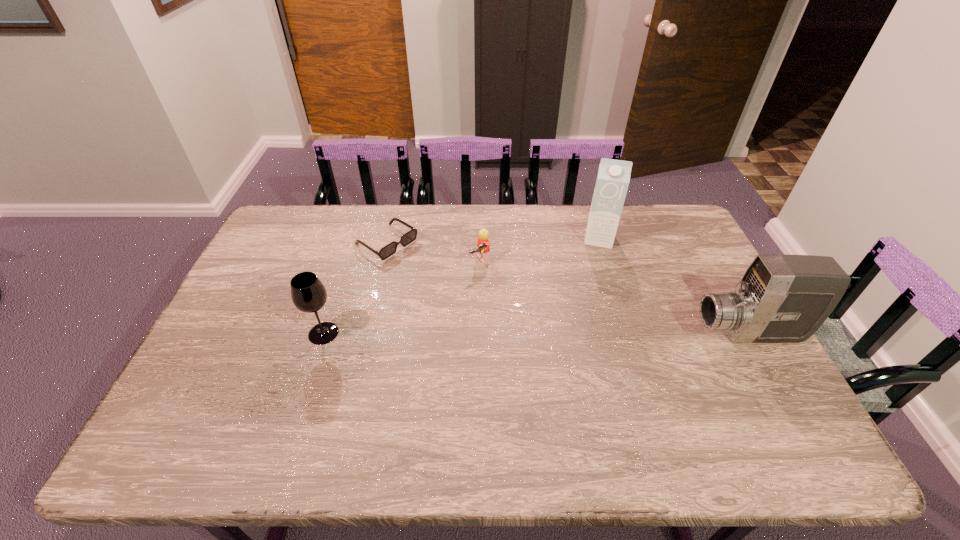
The width and height of the screenshot is (960, 540). What are the coordinates of `free space on the desktop that is between the wineglass and the camcorder and is positioned on the front-facing side of the sunglasses` in the screenshot? It's located at (528, 333).

Identify the location of vacant space on the desktop that is between the wineglass and the camcorder and is positioned in front of the Lego with the accessory visible. (538, 333).

Image resolution: width=960 pixels, height=540 pixels. Find the location of `free spot on the desktop that is between the third shortest object and the camcorder and is positioned on the front label of the carton`. free spot on the desktop that is between the third shortest object and the camcorder and is positioned on the front label of the carton is located at coordinates (588, 333).